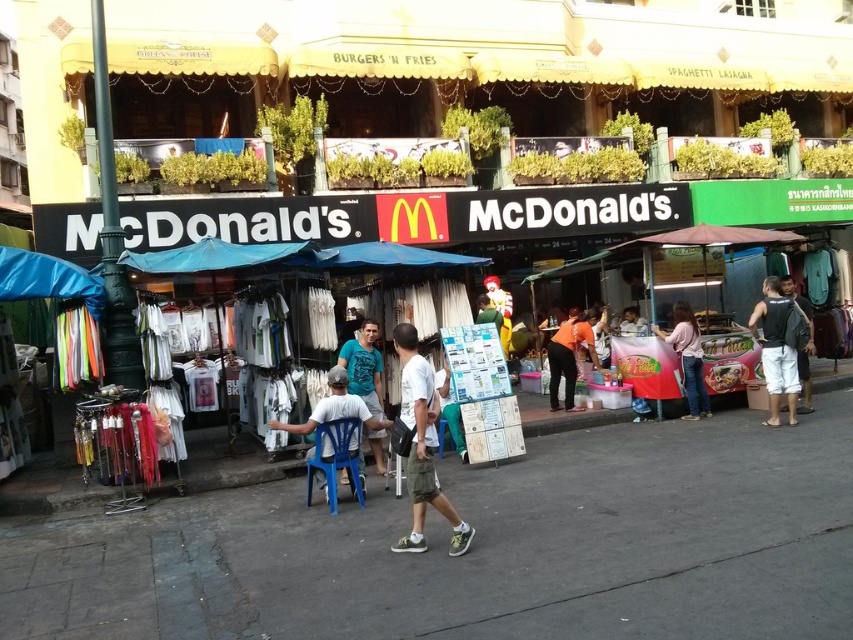
Question: Is blue fabric canopy at left positioned in front of green t-shirt at center?

Choices:
 (A) yes
 (B) no

Answer: (A)

Question: Which object appears closest to the camera in this image?

Choices:
 (A) dark gray backpack at right
 (B) pink fabric dress at center
 (C) white fabric shirt at center
 (D) black backpack at right

Answer: (C)

Question: Which is nearer to the white fabric shirt at center?

Choices:
 (A) black backpack at right
 (B) pink fabric dress at center

Answer: (B)

Question: Can you confirm if white cotton shirt at center is positioned to the left of dark gray backpack at right?

Choices:
 (A) yes
 (B) no

Answer: (A)

Question: Can you confirm if gray concrete pavement at center is wider than white cotton shirt at center?

Choices:
 (A) yes
 (B) no

Answer: (A)

Question: Which object appears closest to the camera in this image?

Choices:
 (A) green t-shirt at center
 (B) black backpack at right
 (C) blue fabric canopy at left

Answer: (C)